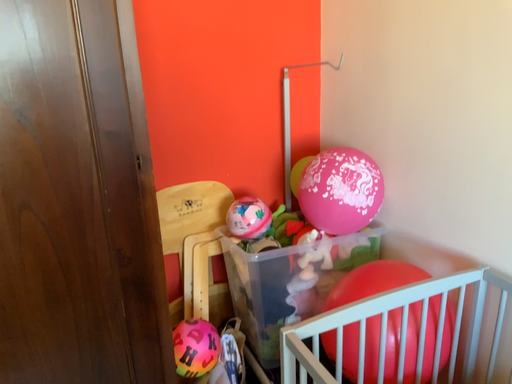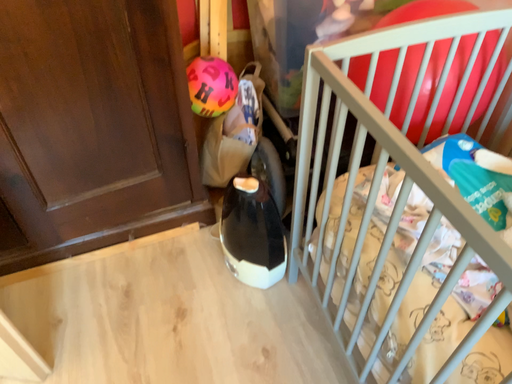
Question: Which way did the camera rotate in the video?

Choices:
 (A) rotated downward
 (B) rotated upward

Answer: (A)